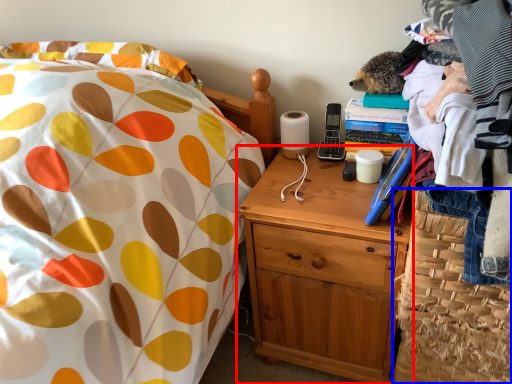
Question: Which point is closer to the camera, nightstand (highlighted by a red box) or basket (highlighted by a blue box)?

Choices:
 (A) nightstand
 (B) basket

Answer: (B)